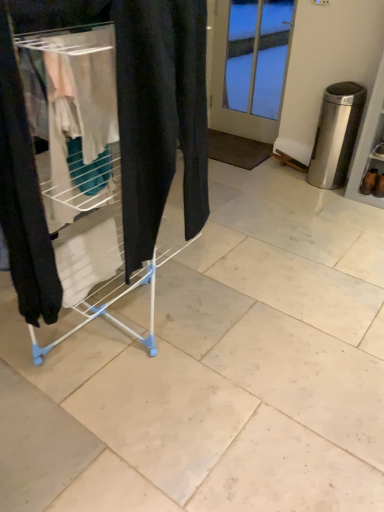
Where is `free space to the right of white plastic drying rack at left`? This screenshot has height=512, width=384. free space to the right of white plastic drying rack at left is located at coordinates (256, 329).